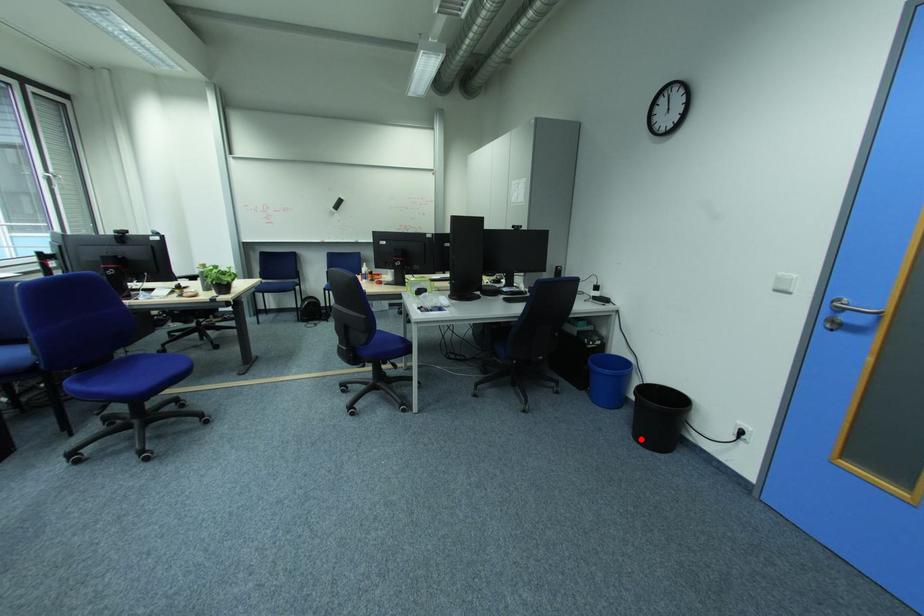
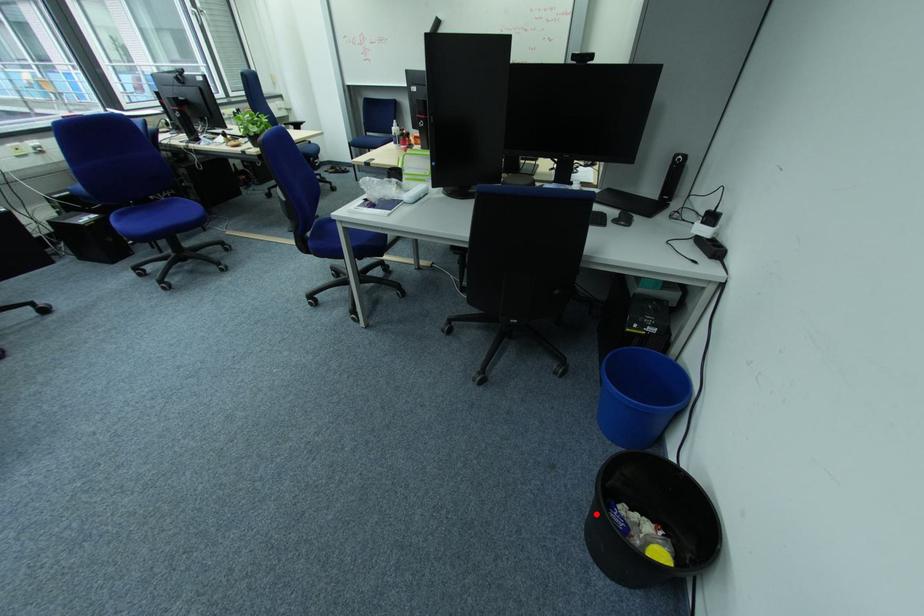
I am providing you with two images of the same scene from different viewpoints. A red point is marked on the first image and another point is marked on the second image. Are the points marked in image1 and image2 representing the same 3D position?

Yes